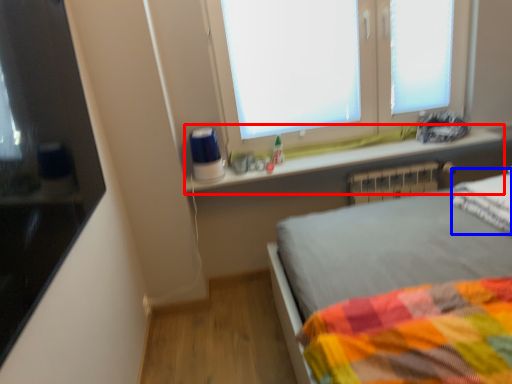
Question: Which object is further to the camera taking this photo, window sill (highlighted by a red box) or pillow (highlighted by a blue box)?

Choices:
 (A) window sill
 (B) pillow

Answer: (A)